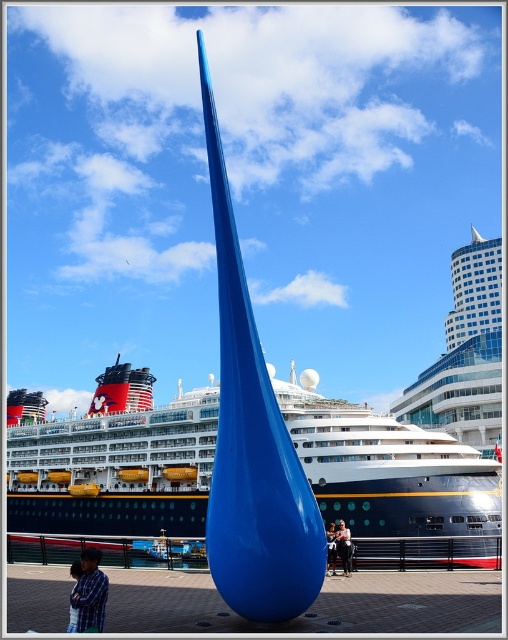
Based on the photo, who is more distant from viewer, (66, 486) or (327, 570)?

The point (66, 486) is more distant.

Is the position of shiny blue ship at center less distant than that of matte blue sculpture at center?

No, it is behind matte blue sculpture at center.

Which is behind, point (197, 525) or point (335, 547)?

The point (197, 525) is more distant.

Locate an element on the screen. Image resolution: width=508 pixels, height=640 pixels. shiny blue ship at center is located at coordinates (114, 468).

How far apart are plaid shirt at lower left and smooth skin person at center?

plaid shirt at lower left is 21.08 meters away from smooth skin person at center.

Who is higher up, plaid shirt at lower left or smooth skin person at center?

Positioned higher is plaid shirt at lower left.

Which is behind, point (100, 588) or point (345, 566)?

Positioned behind is point (345, 566).

In order to click on plaid shirt at lower left in this screenshot , I will do `click(89, 593)`.

Which of these two, shiny blue ship at center or plaid shirt at lower left, stands taller?

shiny blue ship at center

Image resolution: width=508 pixels, height=640 pixels. Describe the element at coordinates (114, 468) in the screenshot. I see `shiny blue ship at center` at that location.

At what (x,y) coordinates should I click in order to perform the action: click on shiny blue ship at center. Please return your answer as a coordinate pair (x, y). This screenshot has width=508, height=640. Looking at the image, I should click on (114, 468).